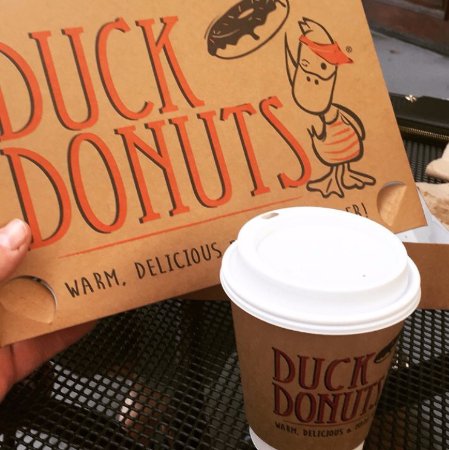
Where is `white coffee cup lid`? This screenshot has width=449, height=450. white coffee cup lid is located at coordinates (x=317, y=258).